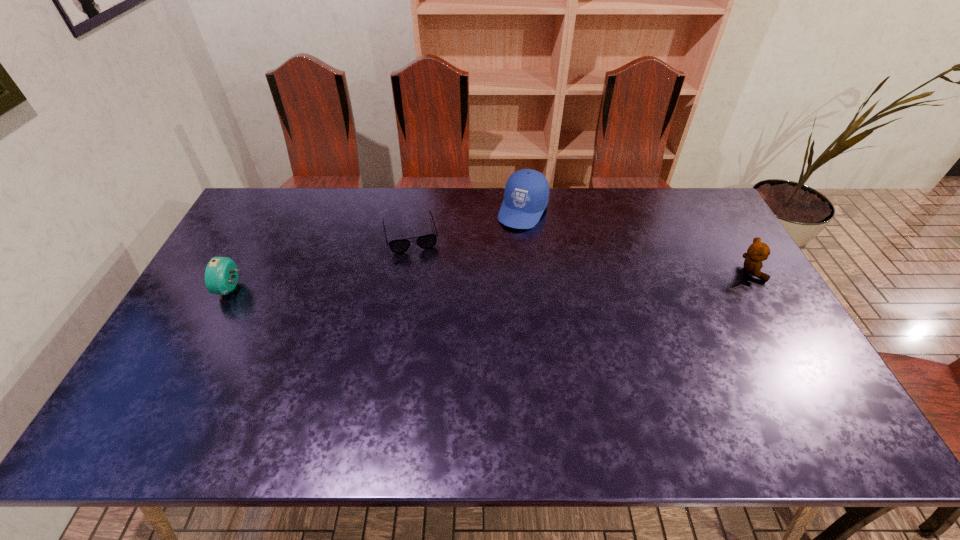
Where is `unoccupied area between the third object from left to right and the alarm clock`? unoccupied area between the third object from left to right and the alarm clock is located at coordinates (377, 250).

This screenshot has width=960, height=540. I want to click on the closest object relative to the alarm clock, so click(428, 241).

Choose which object is the second nearest neighbor to the cap. Please provide its 2D coordinates. Your answer should be formatted as a tuple, i.e. [(x, y)], where the tuple contains the x and y coordinates of a point satisfying the conditions above.

[(758, 251)]

Locate an element on the screen. The width and height of the screenshot is (960, 540). free space that satisfies the following two spatial constraints: 1. on the front side of the teddy bear; 2. on the front-facing side of the second object from left to right is located at coordinates (404, 272).